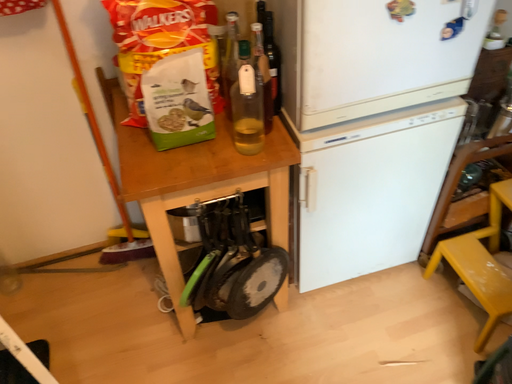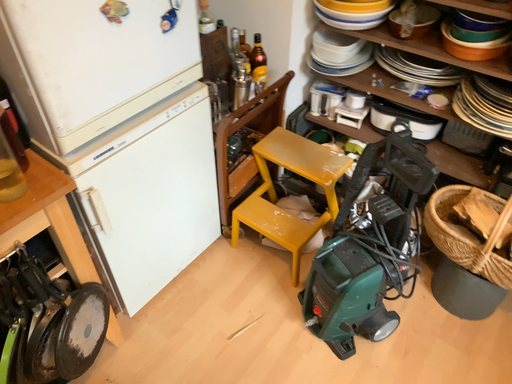
Question: How did the camera likely rotate when shooting the video?

Choices:
 (A) rotated downward
 (B) rotated upward

Answer: (B)